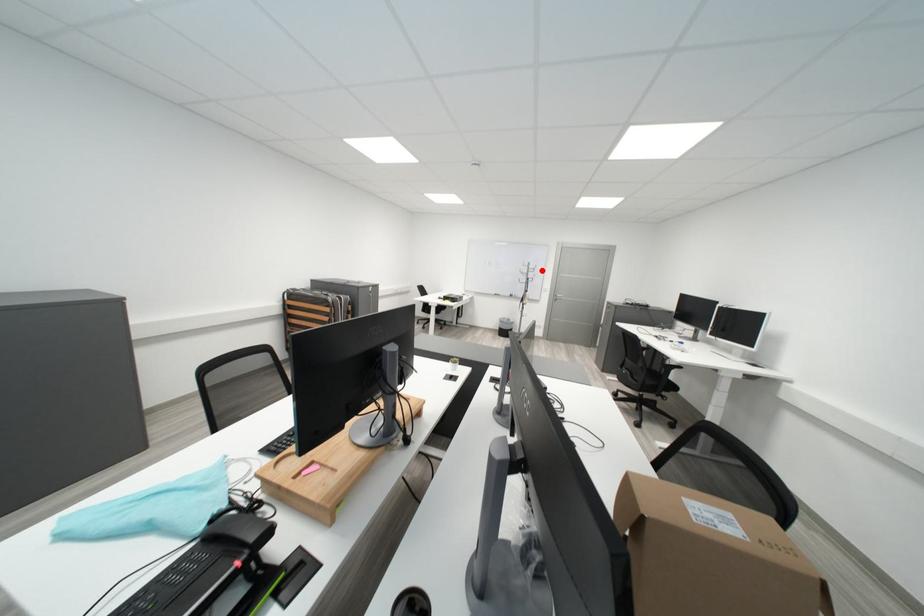
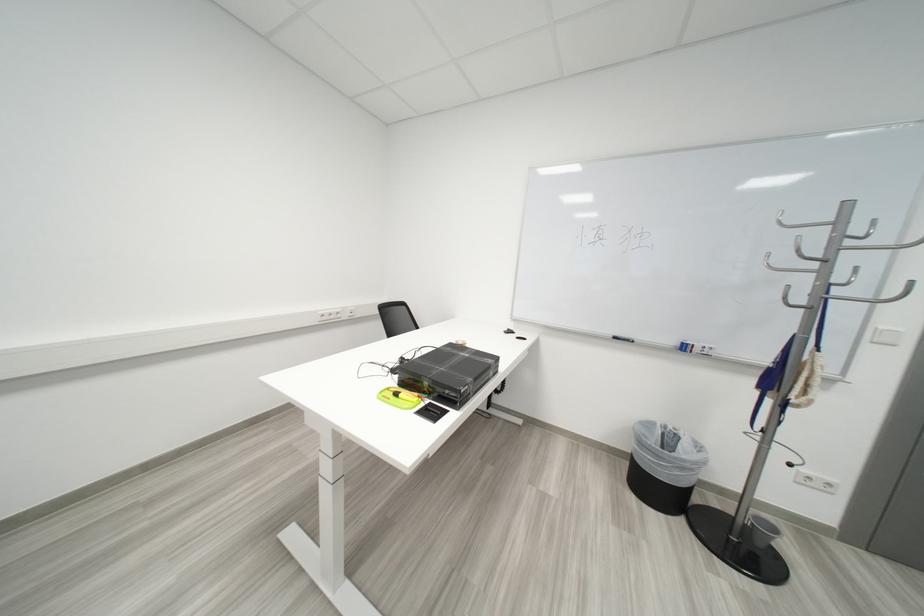
Question: I am providing you with two images of the same scene from different viewpoints. Image1 has a red point marked. In image2, the corresponding 3D location appears at what relative position? Reply with the corresponding letter.

Choices:
 (A) Closer
 (B) Farther

Answer: (B)